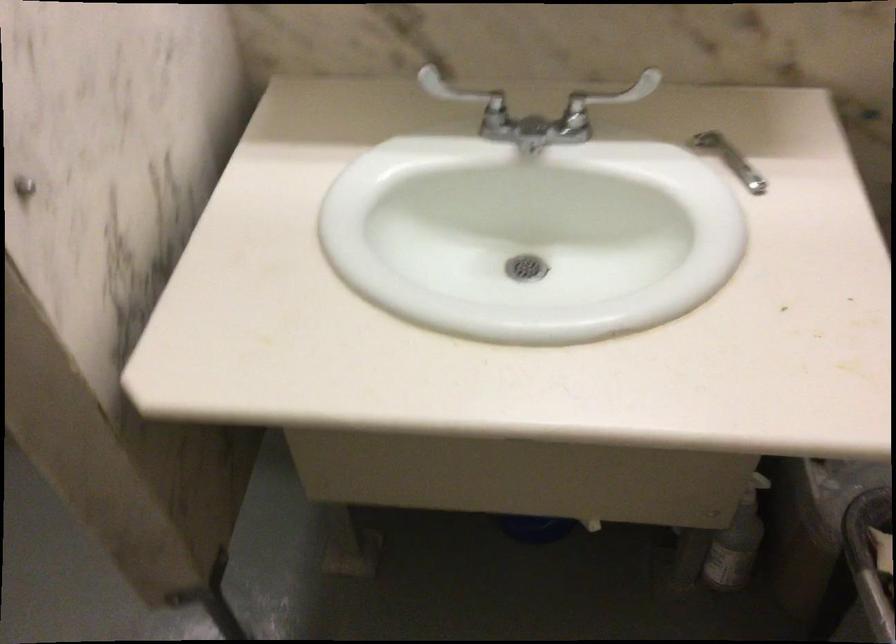
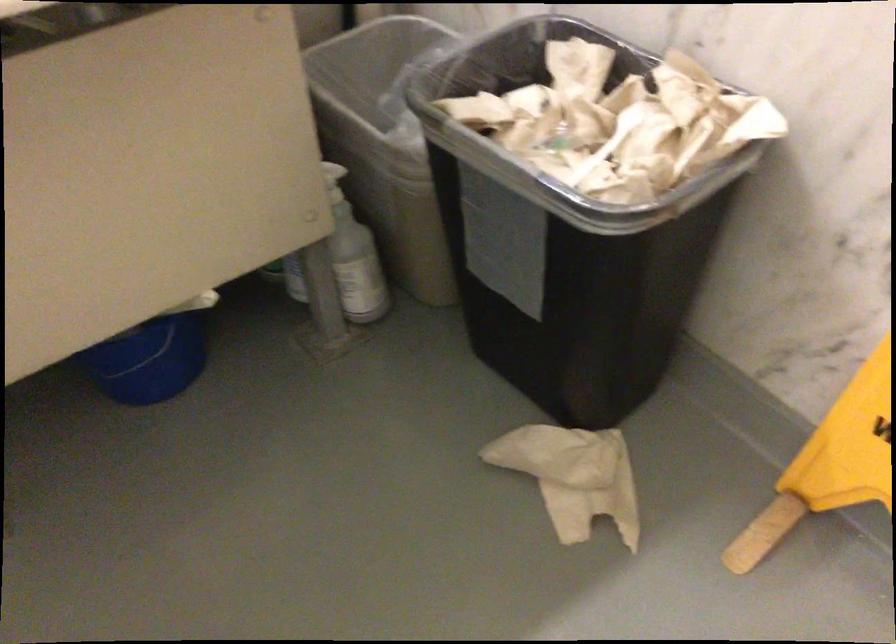
In the second image, find the point that corresponds to (x=746, y=480) in the first image.

(333, 182)